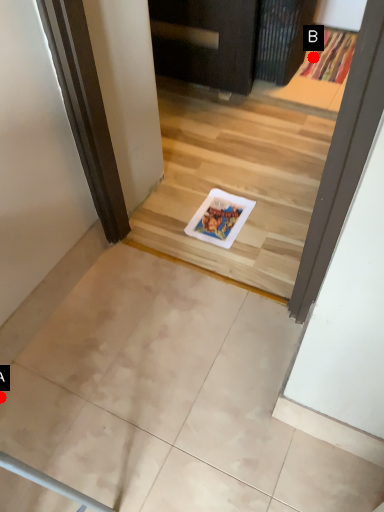
Question: Two points are circled on the image, labeled by A and B beside each circle. Which of the following is the farthest from the observer?

Choices:
 (A) A is further
 (B) B is further

Answer: (B)